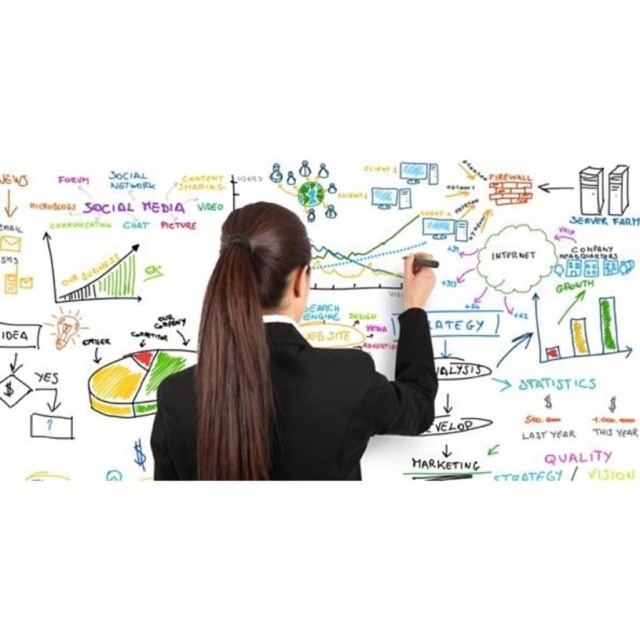
From the picture: Which of these two, black suit at center or brown silky hair at center, stands shorter?

With less height is brown silky hair at center.

Is point (252, 218) closer to camera compared to point (253, 394)?

No, it is not.

Where is `black suit at center`? The height and width of the screenshot is (640, 640). black suit at center is located at coordinates (284, 371).

Which of these two, whiteboard at center or black suit at center, stands shorter?

black suit at center

Is whiteboard at center further to camera compared to black suit at center?

Yes, it is behind black suit at center.

Between point (508, 467) and point (314, 444), which one is positioned behind?

Point (508, 467)

At what (x,y) coordinates should I click in order to perform the action: click on whiteboard at center. Please return your answer as a coordinate pair (x, y). This screenshot has width=640, height=640. Looking at the image, I should click on (330, 304).

Is whiteboard at center bigger than brown silky hair at center?

Yes, whiteboard at center is bigger than brown silky hair at center.

Between whiteboard at center and brown silky hair at center, which one has less height?

brown silky hair at center is shorter.

Which is behind, point (22, 324) or point (234, 324)?

The point (22, 324) is more distant.

Where is `whiteboard at center`? The image size is (640, 640). whiteboard at center is located at coordinates (330, 304).